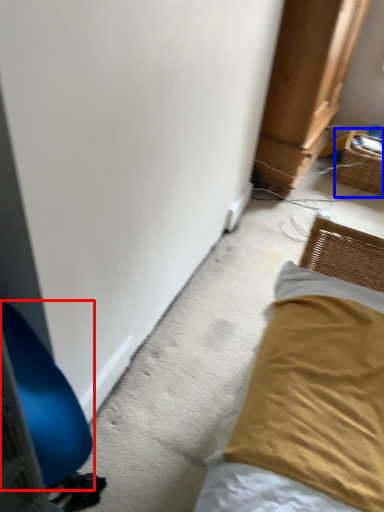
Question: Which object appears closest to the camera in this image, furniture (highlighted by a red box) or basket (highlighted by a blue box)?

Choices:
 (A) furniture
 (B) basket

Answer: (A)